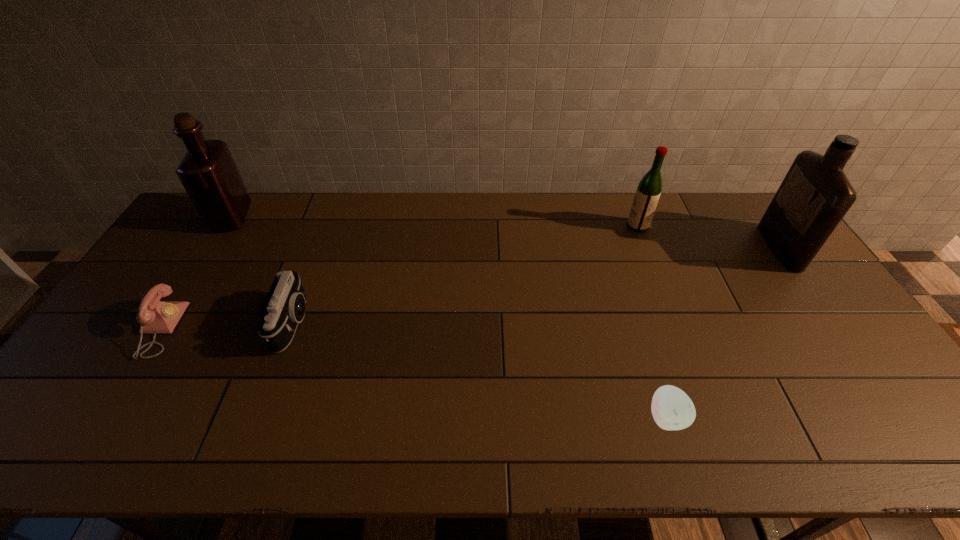
Identify which object is located as the nearest to the rightmost object. Please provide its 2D coordinates. Your answer should be formatted as a tuple, i.e. [(x, y)], where the tuple contains the x and y coordinates of a point satisfying the conditions above.

[(648, 192)]

Identify the location of object that stands as the closest to the fourth tallest object. This screenshot has width=960, height=540. (155, 316).

The height and width of the screenshot is (540, 960). I want to click on liquor that is the second nearest to the leftmost liquor, so click(x=815, y=195).

Where is `liquor that can be found as the closest to the rightmost object`? liquor that can be found as the closest to the rightmost object is located at coordinates (648, 192).

Where is `free location that satisfies the following two spatial constraints: 1. on the back side of the nearest object; 2. on the dial of the telephone`? The width and height of the screenshot is (960, 540). free location that satisfies the following two spatial constraints: 1. on the back side of the nearest object; 2. on the dial of the telephone is located at coordinates (638, 329).

The image size is (960, 540). Find the location of `free space that satisfies the following two spatial constraints: 1. on the dial of the nearest object; 2. on the left side of the telephone`. free space that satisfies the following two spatial constraints: 1. on the dial of the nearest object; 2. on the left side of the telephone is located at coordinates (106, 417).